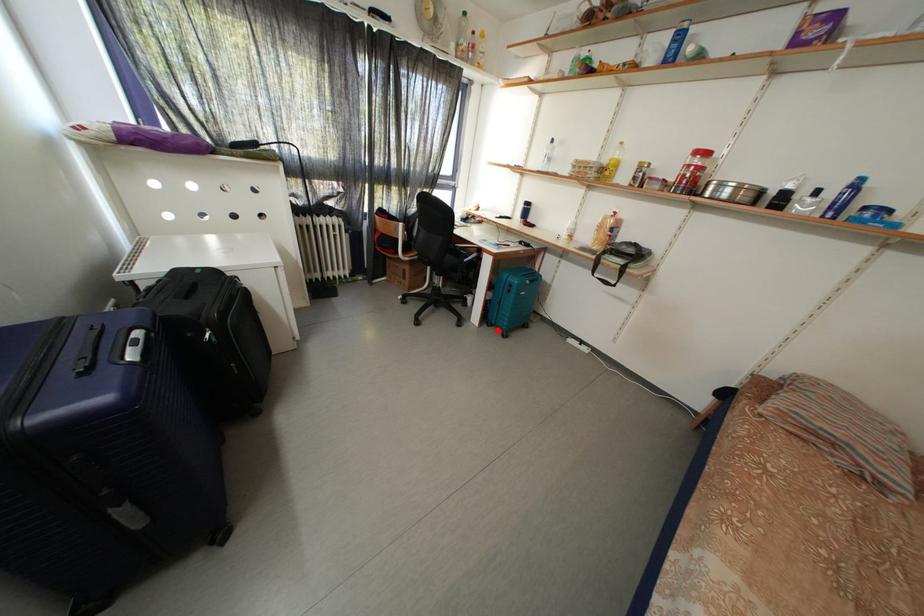
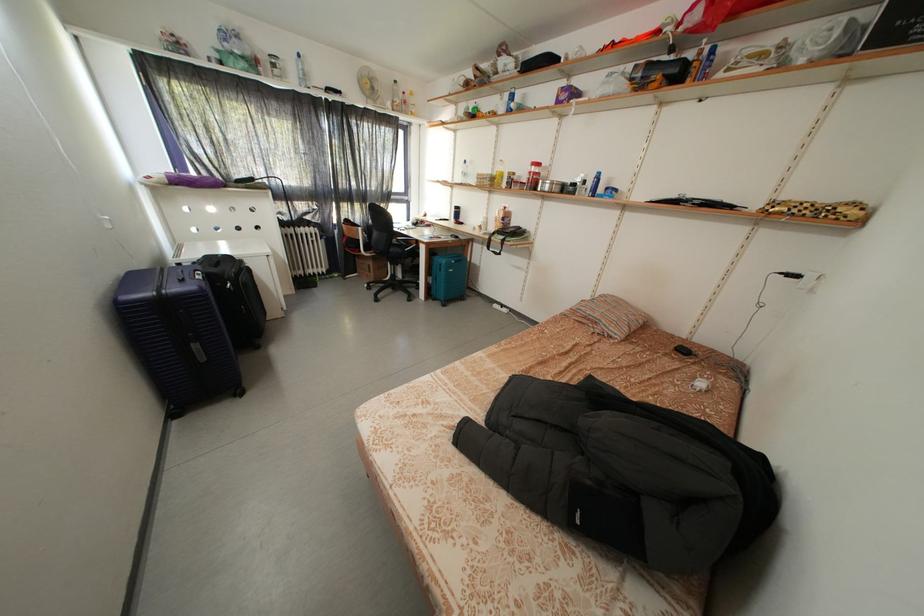
Question: I am providing you with two images of the same scene from different viewpoints. A red point is shown in image1. For the corresponding object point in image2, is it positioned nearer or farther from the camera?

Choices:
 (A) Nearer
 (B) Farther

Answer: (B)